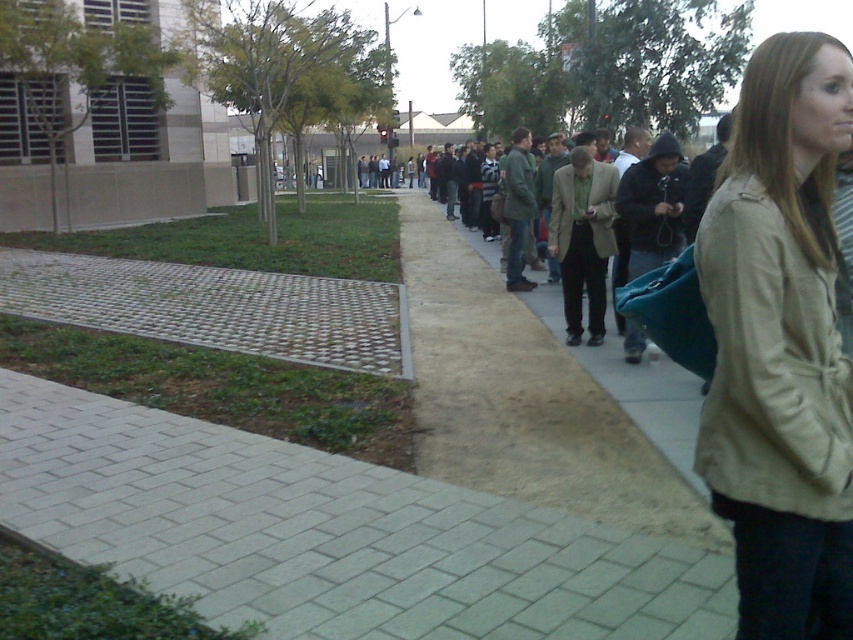
This screenshot has height=640, width=853. What do you see at coordinates (329, 534) in the screenshot? I see `gray brick pavement at lower left` at bounding box center [329, 534].

Based on the photo, who is more forward, [386,632] or [839,384]?

Point [839,384]

Image resolution: width=853 pixels, height=640 pixels. In order to click on gray brick pavement at lower left in this screenshot , I will do `click(329, 534)`.

Which is above, beige fabric jacket at center or brown leather jacket at center?

brown leather jacket at center

Who is more forward, (722, 177) or (666, 497)?

Positioned in front is point (722, 177).

Between point (769, 464) and point (675, 468), which one is positioned behind?

The point (675, 468) is more distant.

Where is `beige fabric jacket at center`? The width and height of the screenshot is (853, 640). beige fabric jacket at center is located at coordinates (781, 344).

Between gray brick pavement at lower left and brown leather jacket at center, which one is positioned higher?

brown leather jacket at center

Who is positioned more to the right, gray brick pavement at lower left or brown leather jacket at center?

brown leather jacket at center is more to the right.

Which is behind, point (722, 636) or point (524, 433)?

Positioned behind is point (524, 433).

Image resolution: width=853 pixels, height=640 pixels. I want to click on gray brick pavement at lower left, so (329, 534).